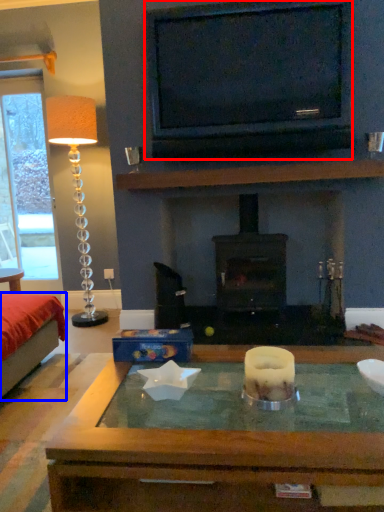
Question: Which of the following is the farthest to the observer, television (highlighted by a red box) or bed (highlighted by a blue box)?

Choices:
 (A) television
 (B) bed

Answer: (A)